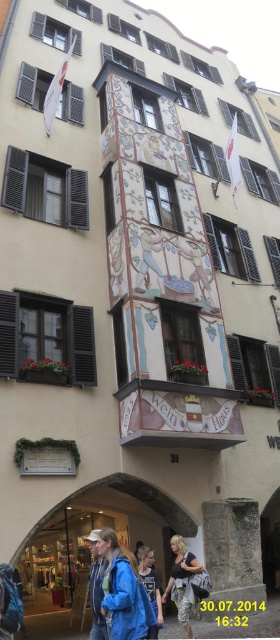
You are standing at a point 31.91 feet away from the point marked as point [127,592]. Given that the building has a curved roofline, can you estimate how far you are from the base of the building?

Since you are 31.91 feet away from point [127,592], which is on the building, and the building has a curved roofline, the distance to the base would depend on the building height and the point location. However, without knowing the building height or the exact position of the point on the building, it is impossible to accurately estimate the distance from the base.